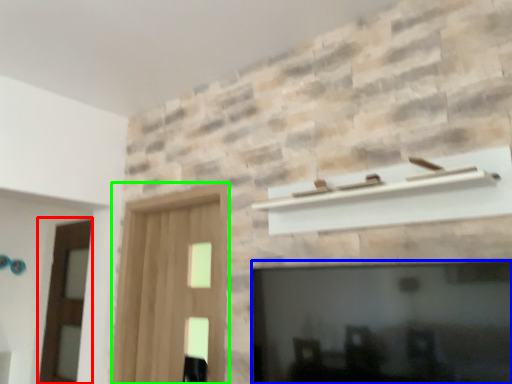
Question: Which object is the closest to the screen door (highlighted by a red box)? Choose among these: fireplace (highlighted by a blue box) or screen door (highlighted by a green box).

Choices:
 (A) fireplace
 (B) screen door

Answer: (B)